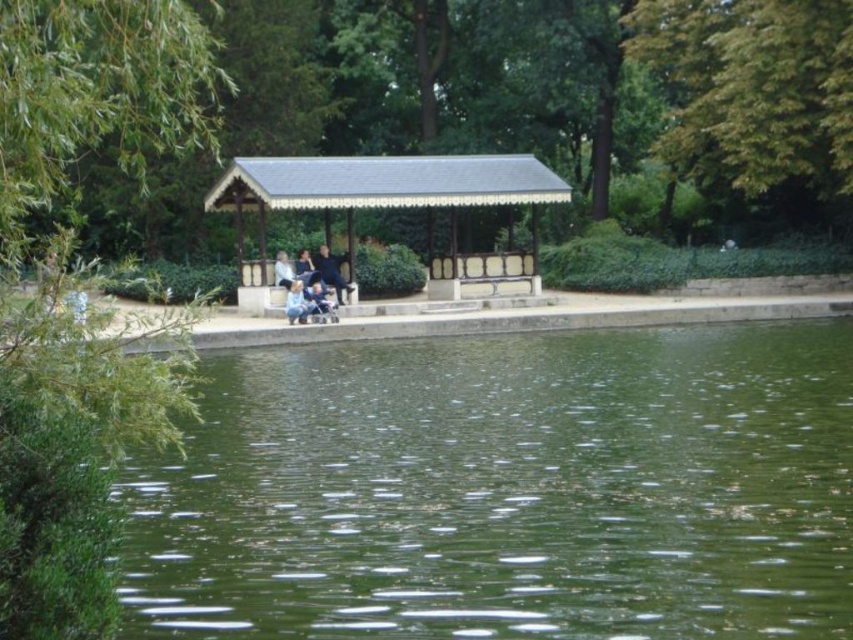
Can you confirm if green leafy tree at upper left is taller than wooden gazebo at center?

Yes, green leafy tree at upper left is taller than wooden gazebo at center.

Who is more forward, (200, 120) or (480, 168)?

Positioned in front is point (200, 120).

Is point (178, 104) closer to camera compared to point (257, 180)?

That is True.

I want to click on green leafy tree at upper left, so click(97, 96).

Is point (488, 609) more distant than point (308, 275)?

No, (488, 609) is closer to viewer.

Consider the image. Does green liquid water at lower center have a greater width compared to dark blue fabric jacket at center?

Indeed, green liquid water at lower center has a greater width compared to dark blue fabric jacket at center.

Who is more distant from viewer, [280,618] or [308,252]?

Positioned behind is point [308,252].

Identify the location of green liquid water at lower center. (506, 490).

Who is positioned more to the left, green leafy tree at upper left or blue denim jeans at center?

From the viewer's perspective, green leafy tree at upper left appears more on the left side.

Is point (47, 164) more distant than point (322, 289)?

No.

Identify the location of green leafy tree at upper left. (97, 96).